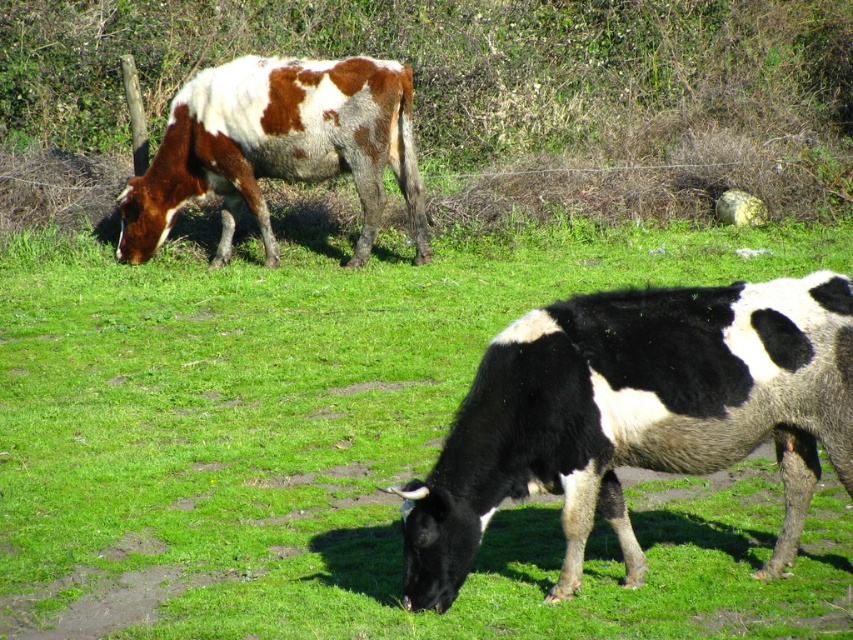
Between black and white cow at center and brown spotted fur at upper left, which one has more height?

black and white cow at center is taller.

Is black and white cow at center taller than brown spotted fur at upper left?

Correct, black and white cow at center is much taller as brown spotted fur at upper left.

Does point (117, 552) lie behind point (316, 122)?

No, (117, 552) is closer to viewer.

Image resolution: width=853 pixels, height=640 pixels. What are the coordinates of `black and white cow at center` in the screenshot? It's located at (351, 451).

Can you confirm if black and white cow at center is smaller than black and white fur at lower right?

No, black and white cow at center is not smaller than black and white fur at lower right.

Does black and white cow at center have a larger size compared to black and white fur at lower right?

Indeed, black and white cow at center has a larger size compared to black and white fur at lower right.

Is point (708, 561) more distant than point (564, 387)?

Yes.

Identify the location of black and white cow at center. This screenshot has height=640, width=853. (351, 451).

From the picture: Can you confirm if black and white fur at lower right is positioned above brown spotted fur at upper left?

No, black and white fur at lower right is not above brown spotted fur at upper left.

Does point (576, 360) come closer to viewer compared to point (204, 90)?

Yes.

This screenshot has width=853, height=640. I want to click on black and white fur at lower right, so click(636, 416).